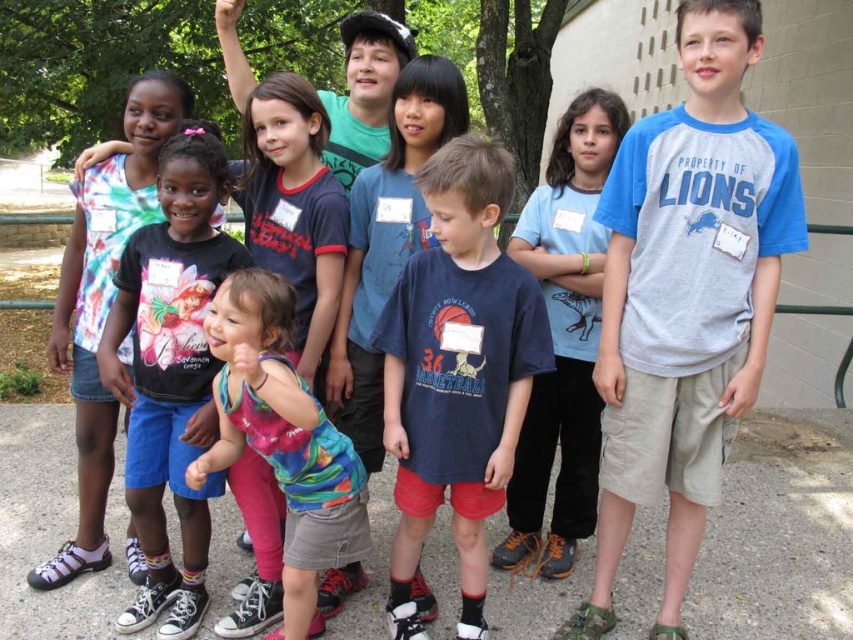
Question: Which object is the closest to the matte black shirt at center?

Choices:
 (A) multicolored fabric dress at center
 (B) gray cotton t-shirt at center
 (C) blue cotton t-shirt at center
 (D) dark blue t-shirt at center

Answer: (A)

Question: Which object is closer to the camera taking this photo?

Choices:
 (A) gray cotton t-shirt at center
 (B) tie-dye fabric shirt at left
 (C) green cotton shirt at upper center
 (D) matte black shirt at center

Answer: (A)

Question: Does dark blue t-shirt at center come in front of blue cotton t-shirt at center?

Choices:
 (A) yes
 (B) no

Answer: (A)

Question: Can you confirm if gray cotton t-shirt at center is thinner than multicolored fabric dress at center?

Choices:
 (A) no
 (B) yes

Answer: (A)

Question: Where is matte black shirt at center located in relation to green cotton shirt at upper center in the image?

Choices:
 (A) below
 (B) above

Answer: (A)

Question: Which point is farther to the camera?

Choices:
 (A) multicolored fabric dress at center
 (B) matte black shirt at center
 (C) gray cotton t-shirt at center

Answer: (B)